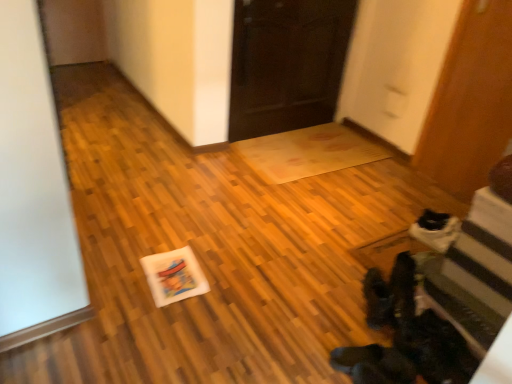
This screenshot has height=384, width=512. I want to click on vacant space underneath dark wood door at center, which appears as the 1th door when viewed from the left (from a real-world perspective), so point(284,131).